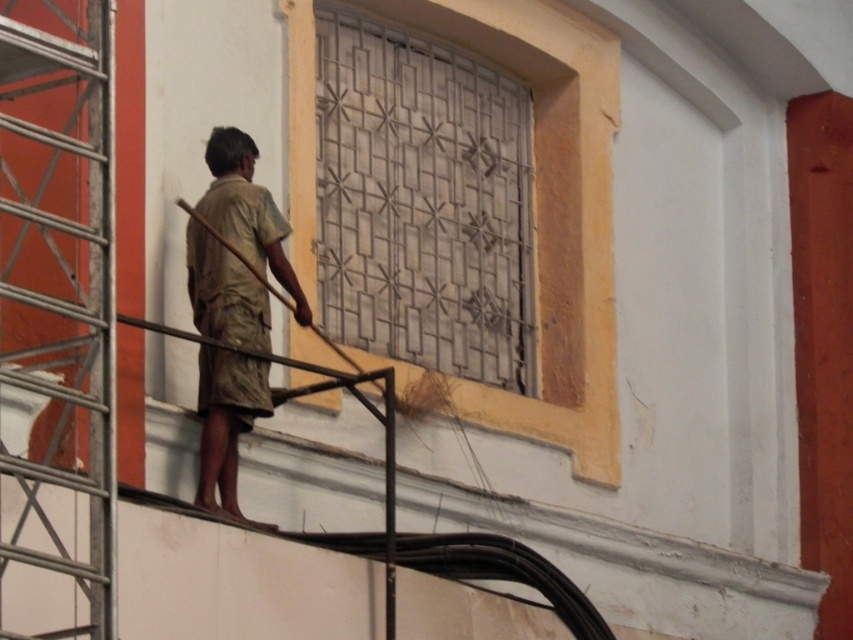
You are standing in front of the building facade where the man is working. You want to reach the point marked at coordinates (x=589, y=305). Considering the distance, can you safely walk to that point without any equipment?

The point at coordinates (x=589, y=305) is 66.30 meters away from the viewer. Since this distance is quite far, you would need appropriate equipment or assistance to safely reach that point on the building facade.